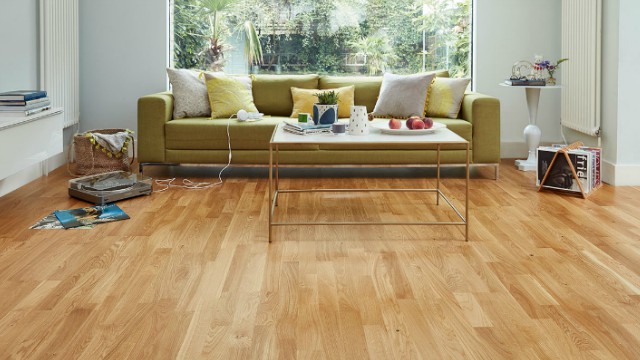
Locate an element on the screen. table legs is located at coordinates (271, 188), (276, 172), (436, 170), (467, 185).